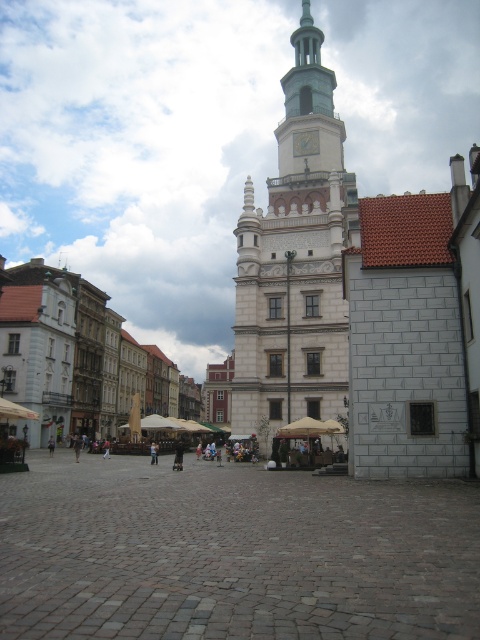
Question: Can you confirm if white stone tower at center is positioned above light brown leather jacket at center?

Choices:
 (A) no
 (B) yes

Answer: (B)

Question: Which of the following is the closest to the observer?

Choices:
 (A) white stone tower at center
 (B) white stone building at left

Answer: (A)

Question: Is white stone tower at center further to camera compared to light brown leather jacket at center?

Choices:
 (A) yes
 (B) no

Answer: (B)

Question: Which point is closer to the camera taking this photo?

Choices:
 (A) (156, 454)
 (B) (59, 285)

Answer: (A)

Question: Which point appears farthest from the camera in this image?

Choices:
 (A) (289, 144)
 (B) (49, 346)
 (C) (153, 449)

Answer: (B)

Question: Is the position of white stone building at left more distant than that of light brown leather jacket at center?

Choices:
 (A) yes
 (B) no

Answer: (A)